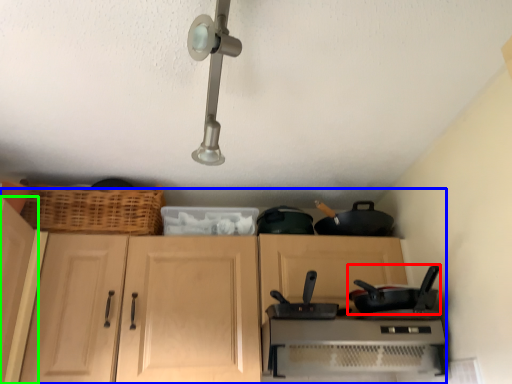
Question: Which object is the closest to the frying pan (highlighted by a red box)? Choose among these: dresser (highlighted by a blue box) or cabinetry (highlighted by a green box).

Choices:
 (A) dresser
 (B) cabinetry

Answer: (A)